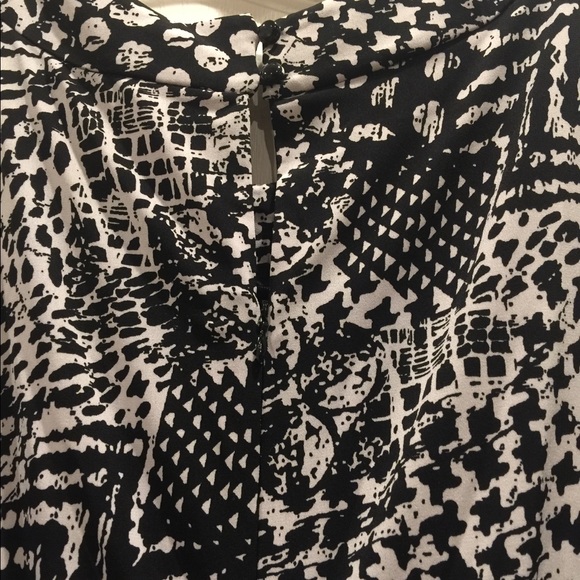
The image size is (580, 580). Identify the location of silky fabric texture. (72, 177).